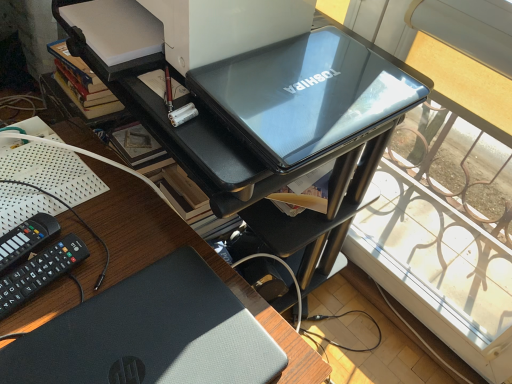
Question: Does black plastic remote control at lower left, placed as the 1th equipment when sorted from left to right, appear on the left side of glossy black laptop at upper center?

Choices:
 (A) no
 (B) yes

Answer: (B)

Question: From a real-world perspective, is black plastic remote control at lower left, placed as the 1th equipment when sorted from left to right, beneath glossy black laptop at upper center?

Choices:
 (A) yes
 (B) no

Answer: (A)

Question: Could you tell me if black plastic remote control at lower left, the second equipment positioned from the right, is turned towards glossy black laptop at upper center?

Choices:
 (A) yes
 (B) no

Answer: (B)

Question: Can you confirm if black plastic remote control at lower left, placed as the 1th equipment when sorted from left to right, is wider than glossy black laptop at upper center?

Choices:
 (A) no
 (B) yes

Answer: (A)

Question: Is the depth of black plastic remote control at lower left, the second equipment positioned from the right, greater than that of glossy black laptop at upper center?

Choices:
 (A) no
 (B) yes

Answer: (A)

Question: Is black plastic remote control at lower left, the second equipment positioned from the right, taller than glossy black laptop at upper center?

Choices:
 (A) no
 (B) yes

Answer: (A)

Question: From the image's perspective, is black plastic remote control at lower left, the second equipment positioned from the right, above glossy white printer at upper center?

Choices:
 (A) no
 (B) yes

Answer: (A)

Question: Does black plastic remote control at lower left, placed as the 1th equipment when sorted from left to right, have a smaller size compared to glossy white printer at upper center?

Choices:
 (A) yes
 (B) no

Answer: (A)

Question: Is black plastic remote control at lower left, the second equipment positioned from the right, facing towards glossy white printer at upper center?

Choices:
 (A) no
 (B) yes

Answer: (A)

Question: Is black plastic remote control at lower left, the second equipment positioned from the right, looking in the opposite direction of glossy white printer at upper center?

Choices:
 (A) no
 (B) yes

Answer: (A)

Question: Is black plastic remote control at lower left, the second equipment positioned from the right, closer to the viewer compared to glossy white printer at upper center?

Choices:
 (A) yes
 (B) no

Answer: (A)

Question: From the image's perspective, does black plastic remote control at lower left, the second equipment positioned from the right, appear lower than glossy white printer at upper center?

Choices:
 (A) no
 (B) yes

Answer: (B)

Question: Is black plastic remote control at lower left, which ranks as the second equipment in left-to-right order, not near slate gray matte laptop at lower left?

Choices:
 (A) yes
 (B) no

Answer: (B)